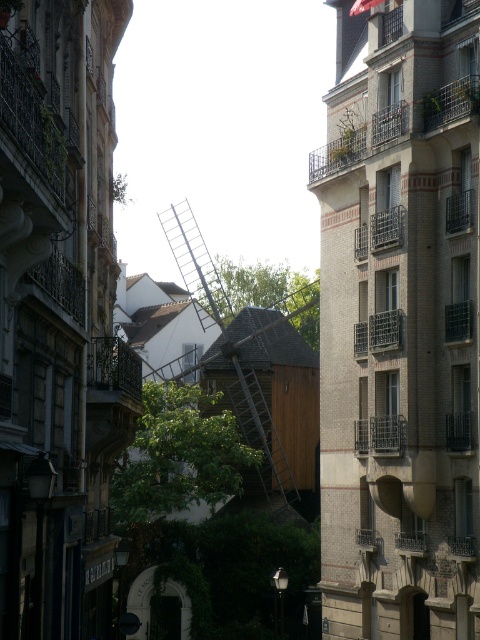
Which of these two, white brick building at center or wooden ladder at center, stands taller?

white brick building at center is taller.

Does point (348, 278) come in front of point (243, 376)?

That is True.

Between point (432, 58) and point (244, 435), which one is positioned behind?

Positioned behind is point (244, 435).

Locate an element on the screen. This screenshot has height=640, width=480. white brick building at center is located at coordinates (399, 323).